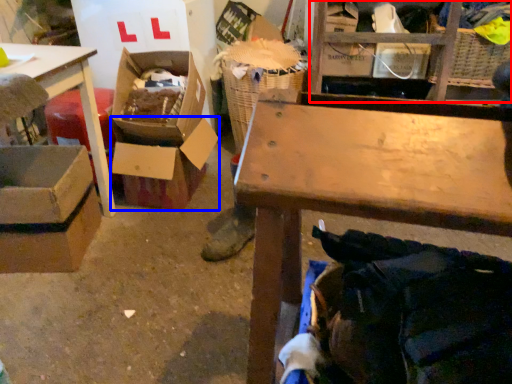
Question: Which of the following is the closest to the observer, shelf (highlighted by a red box) or box (highlighted by a blue box)?

Choices:
 (A) shelf
 (B) box

Answer: (B)